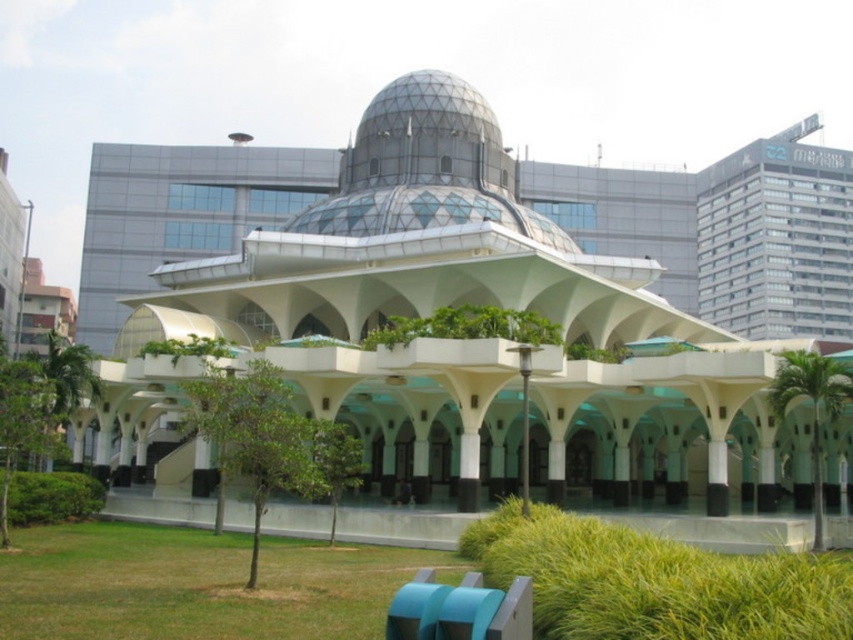
You are a gardener inspecting the lawn in front of the mosque. You notice two patches of green grass at lower left and green grass at lower center. Which patch requires more frequent mowing due to its growth rate?

The green grass at lower center requires more frequent mowing because it is taller than the green grass at lower left.